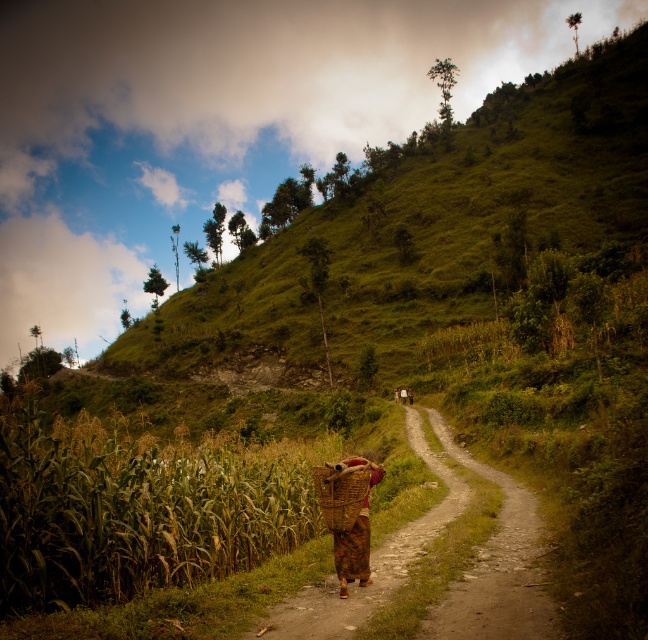
Based on the photo, is green leafy corn at lower left closer to camera compared to brown dirt path at center?

No, green leafy corn at lower left is further to the viewer.

Is green leafy corn at lower left above brown dirt path at center?

No, green leafy corn at lower left is not above brown dirt path at center.

Which is in front, point (248, 490) or point (538, 609)?

Point (538, 609)

Find the location of a particular element. This screenshot has height=640, width=648. green leafy corn at lower left is located at coordinates (139, 506).

Is green leafy corn at lower left positioned in front of brown woven basket at center?

No.

Can you confirm if green leafy corn at lower left is bigger than brown woven basket at center?

Yes.

Who is more distant from viewer, (249, 476) or (362, 465)?

Positioned behind is point (249, 476).

In order to click on green leafy corn at lower left in this screenshot , I will do `click(139, 506)`.

Which is more to the right, brown dirt path at center or brown woven basket at center?

From the viewer's perspective, brown dirt path at center appears more on the right side.

Which is behind, point (356, 588) or point (330, 470)?

The point (356, 588) is more distant.

The image size is (648, 640). I want to click on brown dirt path at center, so click(x=461, y=572).